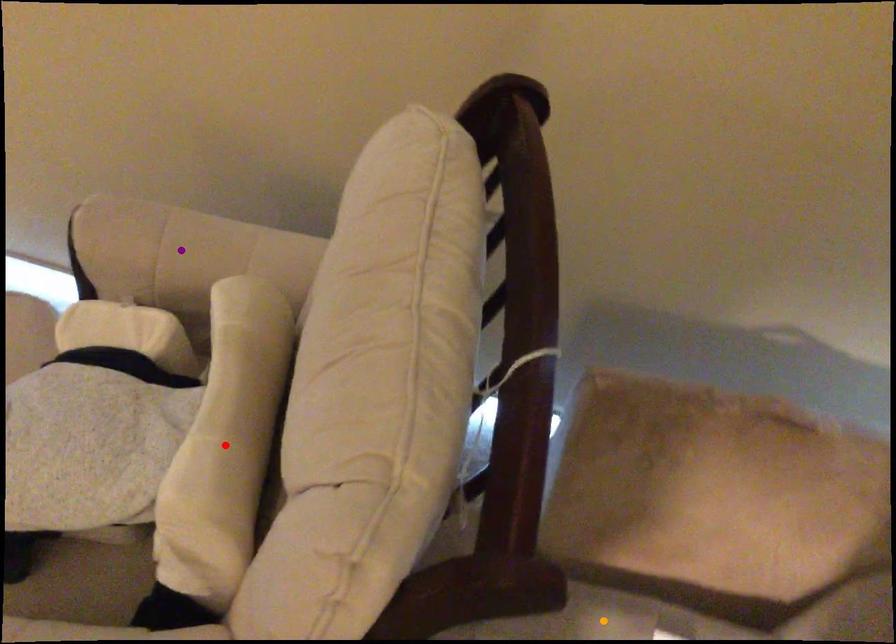
Order these from nearest to farthest:
A) purple point
B) red point
C) orange point

red point
orange point
purple point